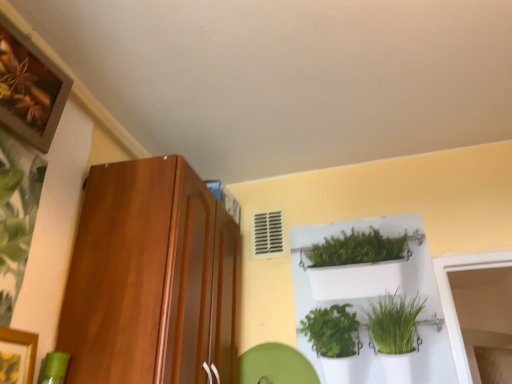
Question: From the image's perspective, is shiny brown cabinet at left located above or below green leafy plant at left?

Choices:
 (A) below
 (B) above

Answer: (A)

Question: Considering the positions of shiny brown cabinet at left and green leafy plant at left in the image, is shiny brown cabinet at left wider or thinner than green leafy plant at left?

Choices:
 (A) wide
 (B) thin

Answer: (A)

Question: Estimate the real-world distances between objects in this image. Which object is farther from the white plastic shelf at upper center?

Choices:
 (A) shiny brown cabinet at left
 (B) wooden framed artwork at upper left
 (C) green leafy plant at left

Answer: (B)

Question: Which is farther from the white plastic shelf at upper center?

Choices:
 (A) green leafy plant at left
 (B) shiny brown cabinet at left
 (C) wooden framed artwork at upper left

Answer: (C)